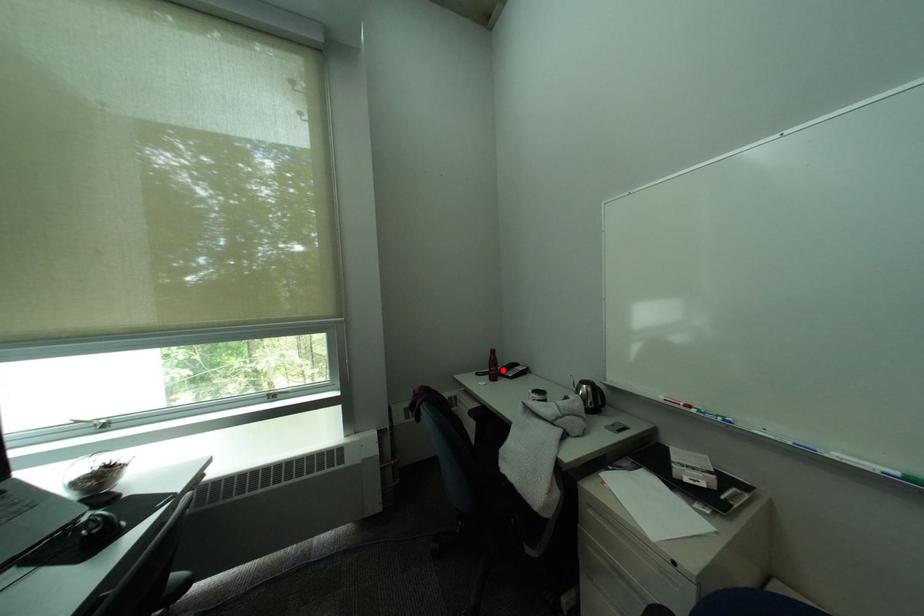
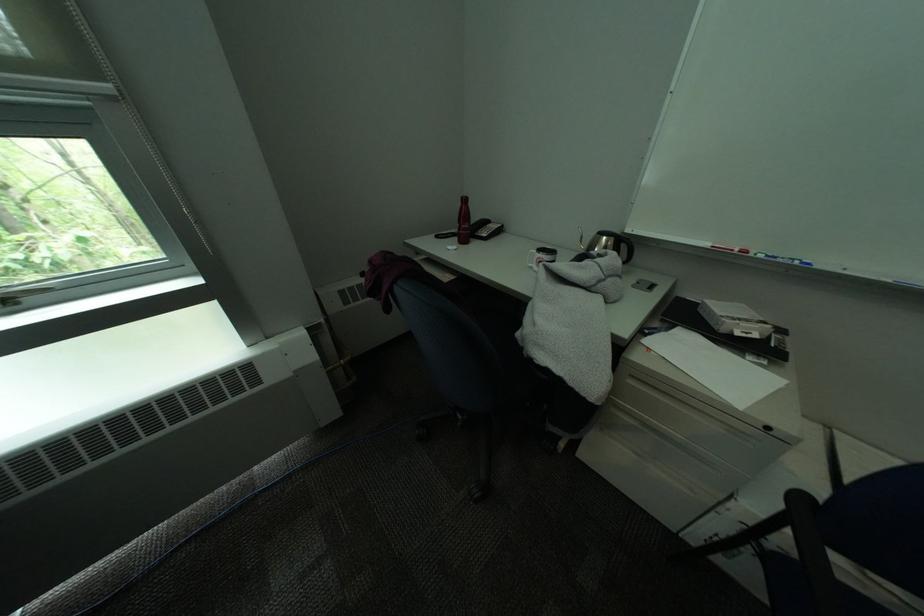
Find the pixel in the second image that matches the highlighted location in the first image.

(475, 228)